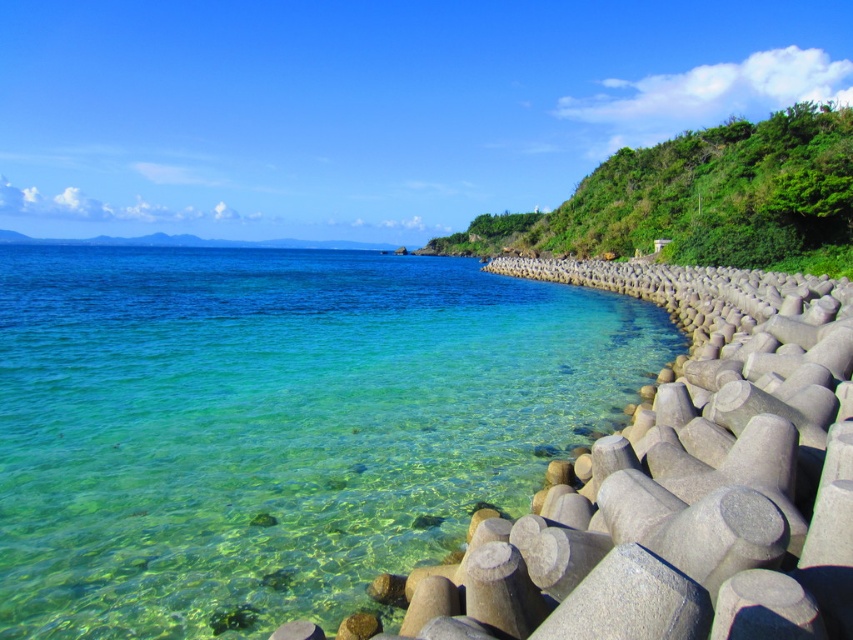
You are a photographer planning to capture the clear water at lower left and the green leafy hillside at upper right in a single frame. Based on their spatial relationship, which object would appear smaller in the photo?

The clear water at lower left occupies less space than the green leafy hillside at upper right, so it would appear smaller in the photo.

You are standing at the origin point of the image, which is the bottom left corner. You want to reach the clear water at lower left as quickly as possible. In which direction should you move?

Since the clear water at lower left is located at point (276,426), you should move towards the right and slightly upwards from the origin point to reach it quickly.